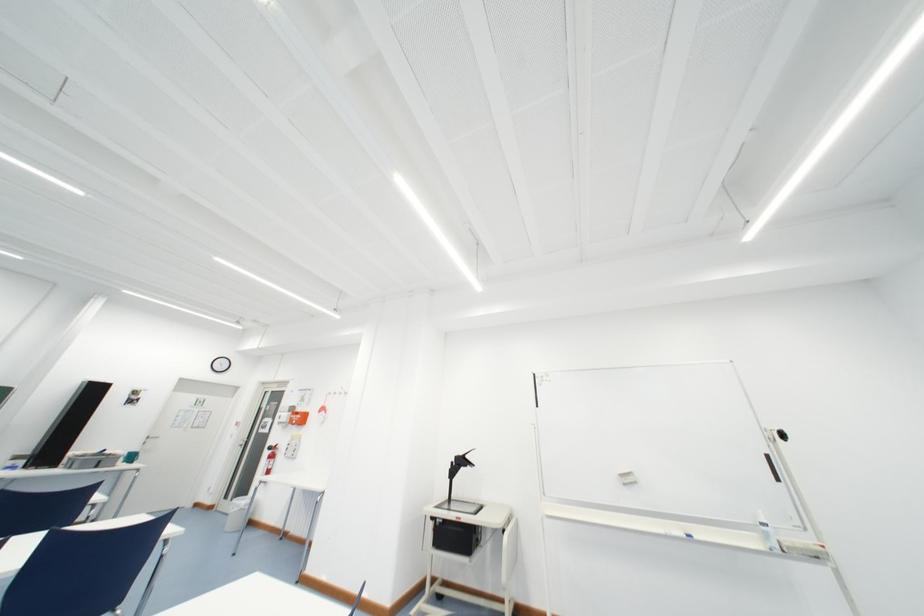
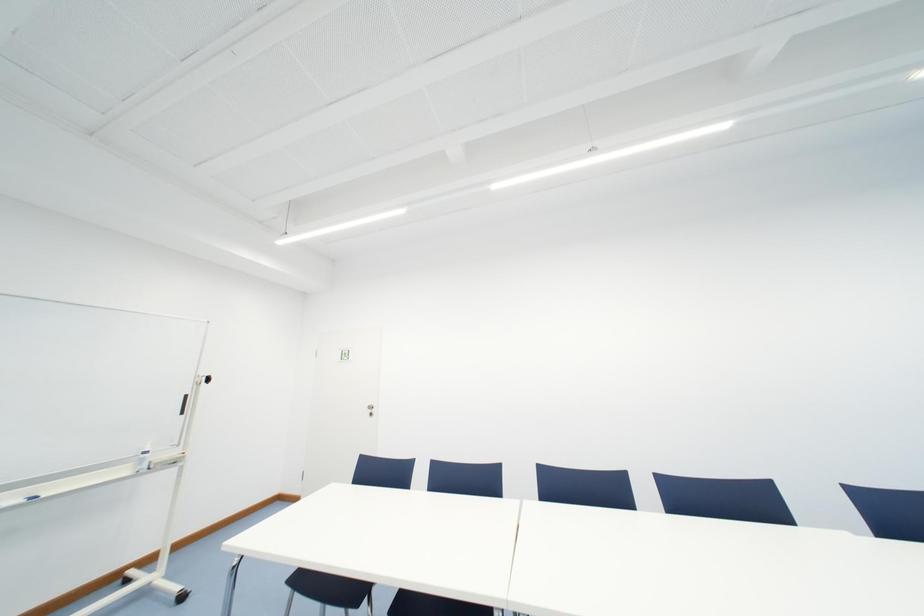
Question: How did the camera likely rotate?

Choices:
 (A) Left
 (B) Right
 (C) Up
 (D) Down

Answer: (B)